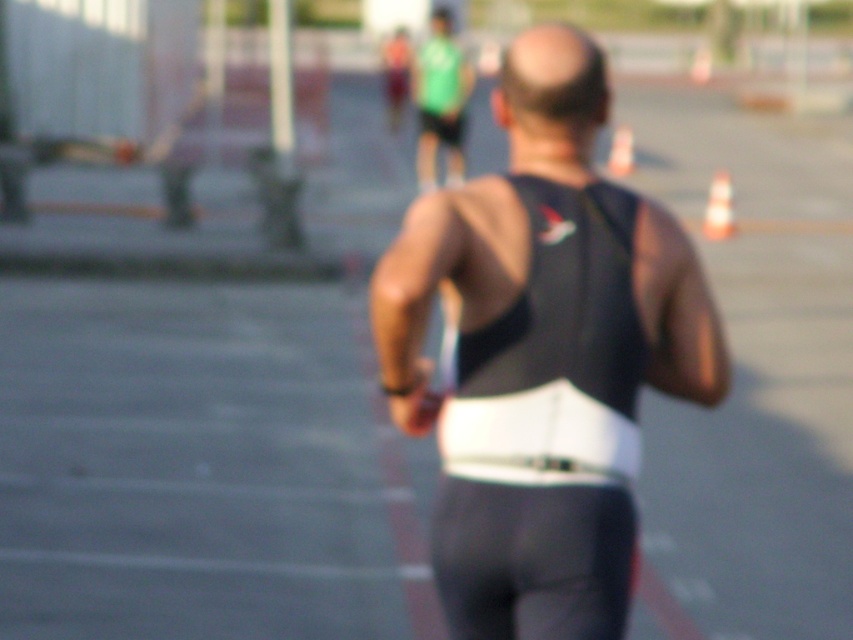
Can you confirm if black matte triathlon suit at center is wider than white plastic cone at upper center?

Yes, black matte triathlon suit at center is wider than white plastic cone at upper center.

This screenshot has width=853, height=640. Identify the location of black matte triathlon suit at center. coord(546,262).

Is point (669, 307) farther from viewer compared to point (631, 136)?

No, (669, 307) is closer to viewer.

Identify the location of black matte triathlon suit at center. The image size is (853, 640). (546, 262).

Can you confirm if black matte vest at center is wider than white plastic traffic cone at right?

Yes, black matte vest at center is wider than white plastic traffic cone at right.

Is black matte vest at center to the left of white plastic traffic cone at right from the viewer's perspective?

Indeed, black matte vest at center is positioned on the left side of white plastic traffic cone at right.

This screenshot has height=640, width=853. What are the coordinates of `black matte vest at center` in the screenshot? It's located at (554, 353).

Between black matte vest at center and white plastic cone at upper center, which one appears on the left side from the viewer's perspective?

From the viewer's perspective, black matte vest at center appears more on the left side.

Does black matte vest at center have a smaller size compared to white plastic cone at upper center?

Correct, black matte vest at center occupies less space than white plastic cone at upper center.

Who is more distant from viewer, (x=546, y=368) or (x=619, y=177)?

The point (x=619, y=177) is more distant.

Locate an element on the screen. This screenshot has height=640, width=853. black matte vest at center is located at coordinates (554, 353).